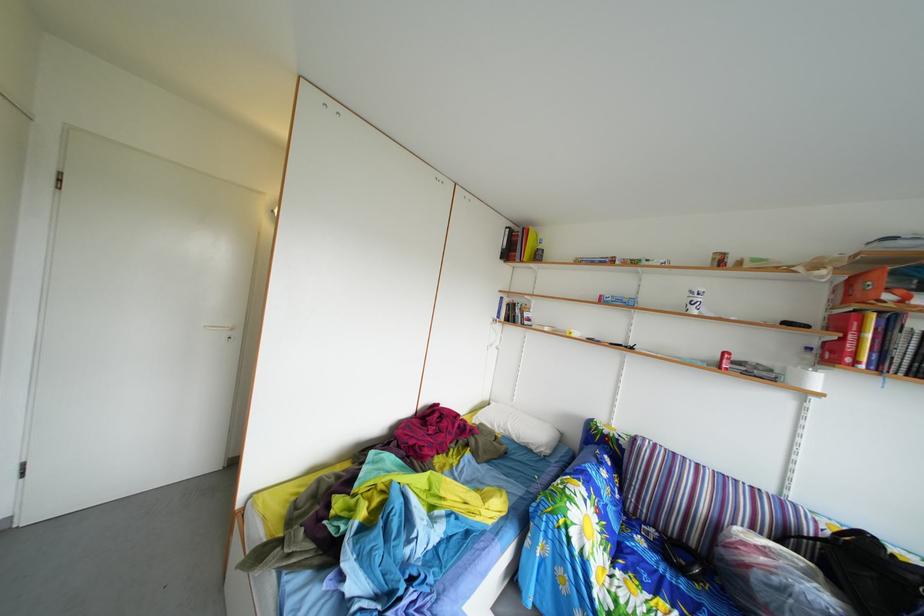
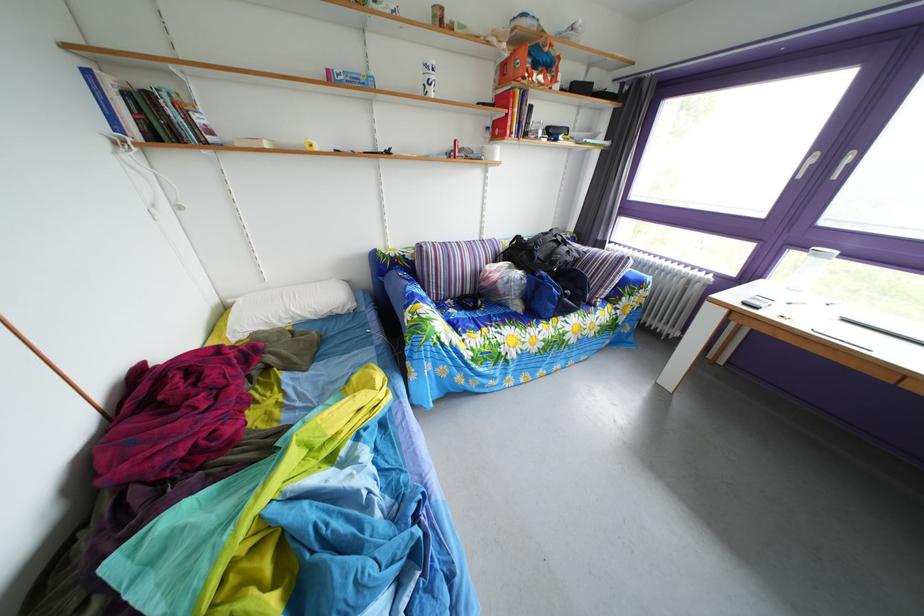
Where in the second image is the point corresponding to the point at 650,548 from the first image?

(463, 320)